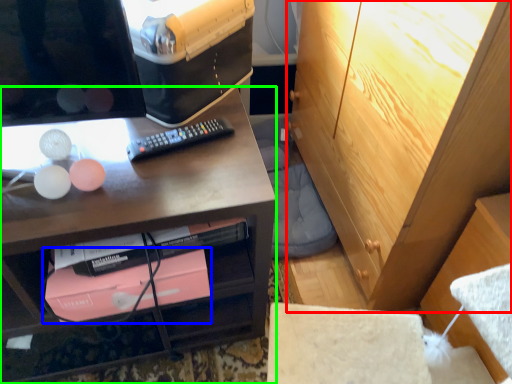
Question: Which object is positioned closest to cabinetry (highlighted by a red box)? Select from book (highlighted by a blue box) and desk (highlighted by a green box).

Choices:
 (A) book
 (B) desk

Answer: (B)